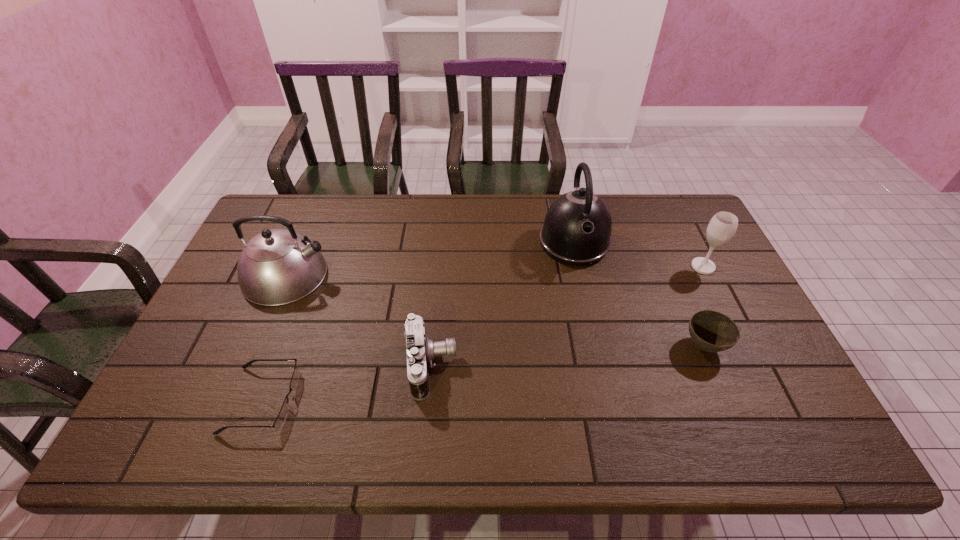
You are a GUI agent. You are given a task and a screenshot of the screen. Output one action in this format:
    pyautogui.click(x=<x>, y=<y>)
    Task: Click on the free space that satisfies the following two spatial constraints: 1. on the spout of the right kettle; 2. from the spout of the left kettle
    This screenshot has height=540, width=960.
    Given the screenshot: What is the action you would take?
    pyautogui.click(x=581, y=275)